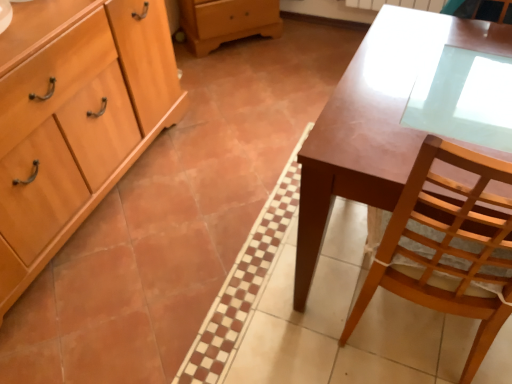
You are a GUI agent. You are given a task and a screenshot of the screen. Output one action in this format:
    pyautogui.click(x=<x>, y=<y>)
    Task: Click on the vacant region to the left of matte brown desk at center
    The image size is (512, 384).
    Given the screenshot: What is the action you would take?
    pyautogui.click(x=224, y=254)